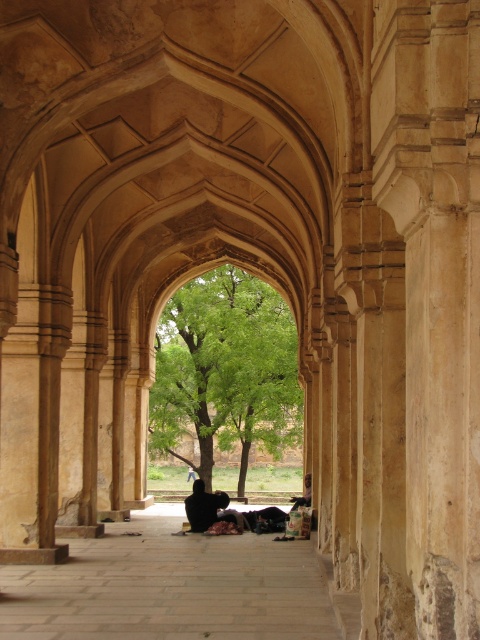
Question: Is green leafy tree at center above dark brown fabric at center?

Choices:
 (A) yes
 (B) no

Answer: (A)

Question: Does green leafy tree at center have a smaller size compared to dark brown fabric at center?

Choices:
 (A) no
 (B) yes

Answer: (A)

Question: Does green leafy tree at center have a smaller size compared to dark brown fabric at center?

Choices:
 (A) yes
 (B) no

Answer: (B)

Question: Which point is closer to the camera?

Choices:
 (A) dark brown fabric at center
 (B) green leafy tree at center

Answer: (A)